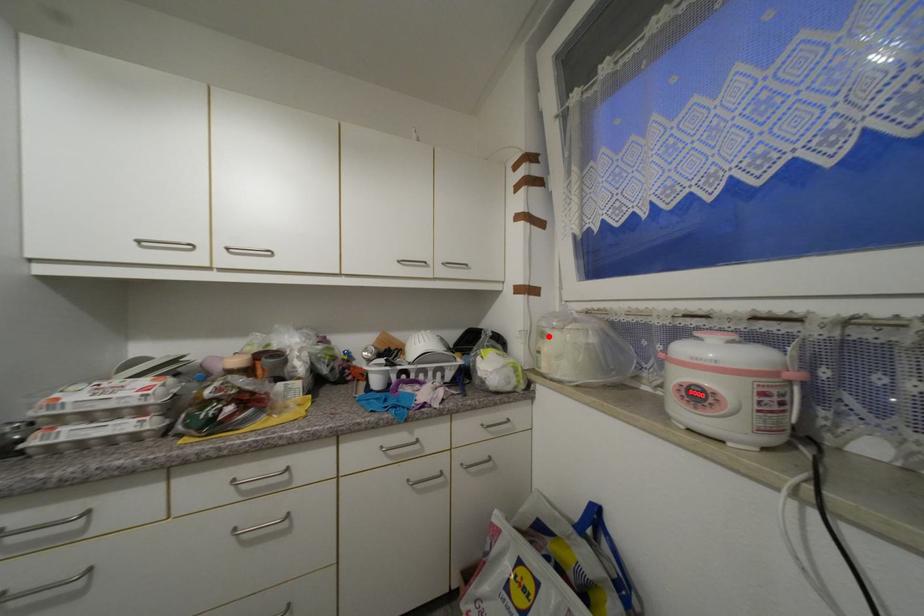
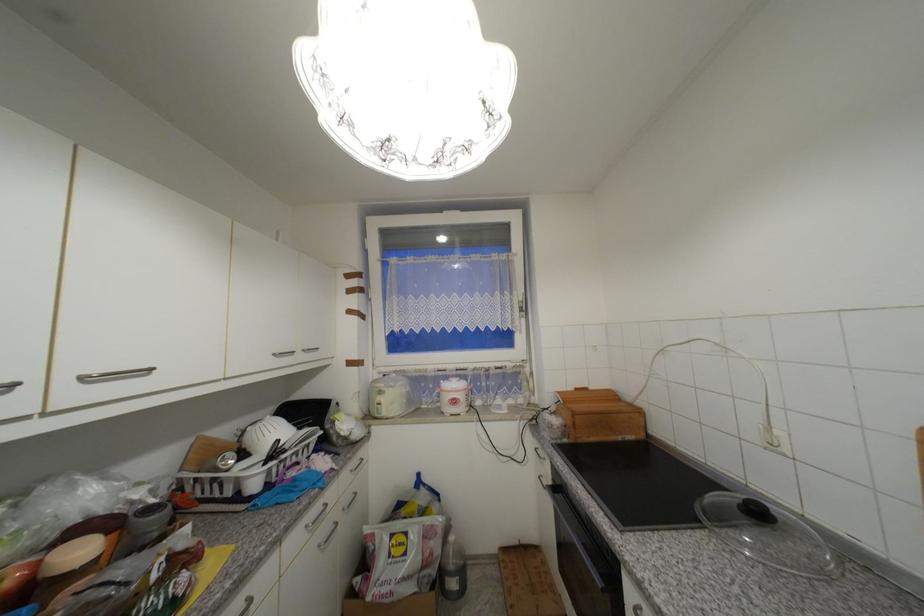
Find the pixel in the second image that matches the highlighted location in the first image.

(386, 394)